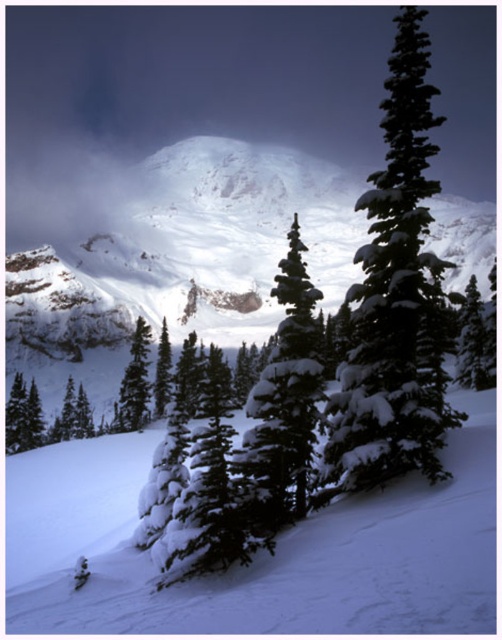
You are standing in the winter landscape scene. There are two points marked in the image. The first point is at coordinates point [388,106] and the second is at point [145,392]. Which of these two points is closer to you?

Point [388,106] is closer to the viewer than point [145,392].